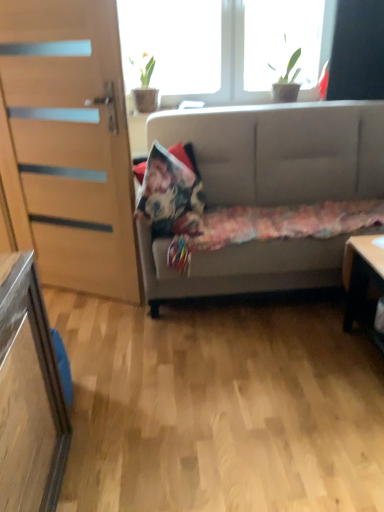
Measure the distance between wooden door at left and camera.

wooden door at left and camera are 5.88 feet apart from each other.

What is the approximate height of light gray fabric couch at center?

light gray fabric couch at center is 3.38 feet tall.

This screenshot has width=384, height=512. What do you see at coordinates (282, 151) in the screenshot?
I see `light gray fabric couch at center` at bounding box center [282, 151].

Locate an element on the screen. The image size is (384, 512). floral fabric pillow at center is located at coordinates (170, 191).

Locate an element on the screen. transparent glass window at upper center, arranged as the 1th window when viewed from the left is located at coordinates tap(189, 49).

In order to face light brown wood desk at lower right, should I rotate leftwards or rightwards?

You should rotate right by 25.357 degrees.

Where is `green leafy plant at upper right, which is counted as the 2th window, starting from the left`? This screenshot has height=512, width=384. green leafy plant at upper right, which is counted as the 2th window, starting from the left is located at coordinates (281, 41).

What's the angular difference between green leafy plant at upper center and wooden door at left's facing directions?

They differ by 25.9 degrees in their facing directions.

Image resolution: width=384 pixels, height=512 pixels. Identify the location of houseplant located above the wooden door at left (from the image's perspective). (146, 87).

From the image's perspective, is green leafy plant at upper center under wooden door at left?

No, from the image's perspective, green leafy plant at upper center is not beneath wooden door at left.

Based on the photo, is the surface of green leafy plant at upper center in direct contact with wooden door at left?

No, green leafy plant at upper center is not beside wooden door at left.

Is floral fabric pillow at center facing away from transparent glass window at upper center, arranged as the 1th window when viewed from the left?

No, transparent glass window at upper center, arranged as the 1th window when viewed from the left, is not at the back of floral fabric pillow at center.

Based on their positions, is floral fabric pillow at center located to the left or right of transparent glass window at upper center, which is the 2th window in right-to-left order?

Based on their positions, floral fabric pillow at center is located to the left of transparent glass window at upper center, which is the 2th window in right-to-left order.

Can you confirm if floral fabric pillow at center is thinner than transparent glass window at upper center, arranged as the 1th window when viewed from the left?

No, floral fabric pillow at center is not thinner than transparent glass window at upper center, arranged as the 1th window when viewed from the left.

Considering the sizes of objects floral fabric pillow at center and transparent glass window at upper center, which is the 2th window in right-to-left order, in the image provided, who is smaller, floral fabric pillow at center or transparent glass window at upper center, which is the 2th window in right-to-left order,?

With smaller size is floral fabric pillow at center.

Based on their sizes in the image, would you say green leafy plant at upper right, which is the 1th window from right to left, is bigger or smaller than floral fabric pillow at center?

green leafy plant at upper right, which is the 1th window from right to left, is smaller than floral fabric pillow at center.

Is floral fabric pillow at center a part of green leafy plant at upper right, which is the 1th window from right to left?

No, green leafy plant at upper right, which is the 1th window from right to left, does not contain floral fabric pillow at center.

Could you tell me if green leafy plant at upper right, which is counted as the 2th window, starting from the left, is facing floral fabric pillow at center?

No.

Identify the location of pillow directly beneath the green leafy plant at upper right, which is counted as the 2th window, starting from the left (from a real-world perspective). This screenshot has height=512, width=384. (170, 191).

From a real-world perspective, which object rests below the other?

In real-world perspective, light brown wood desk at lower right is lower.

Is light brown wood desk at lower right in front of or behind green leafy plant at upper right, which is the 1th window from right to left, in the image?

Visually, light brown wood desk at lower right is located in front of green leafy plant at upper right, which is the 1th window from right to left.

From the image's perspective, which is above, light brown wood desk at lower right or green leafy plant at upper right, which is the 1th window from right to left?

From the image's view, green leafy plant at upper right, which is the 1th window from right to left, is above.

Measure the distance from light brown wood desk at lower right to green leafy plant at upper right, which is counted as the 2th window, starting from the left.

light brown wood desk at lower right and green leafy plant at upper right, which is counted as the 2th window, starting from the left, are 5.44 feet apart from each other.

Considering the sizes of objects green leafy plant at upper right, which is counted as the 2th window, starting from the left, and fluffy multicolored blanket at center in the image provided, who is taller, green leafy plant at upper right, which is counted as the 2th window, starting from the left, or fluffy multicolored blanket at center?

Standing taller between the two is green leafy plant at upper right, which is counted as the 2th window, starting from the left.

Looking at their sizes, would you say green leafy plant at upper right, which is the 1th window from right to left, is wider or thinner than fluffy multicolored blanket at center?

Considering their sizes, green leafy plant at upper right, which is the 1th window from right to left, looks slimmer than fluffy multicolored blanket at center.

Looking at this image, would you say green leafy plant at upper right, which is counted as the 2th window, starting from the left, is part of floral fabric pillow at center's contents?

That's incorrect, green leafy plant at upper right, which is counted as the 2th window, starting from the left, is not inside floral fabric pillow at center.

In the image, is floral fabric pillow at center positioned in front of or behind green leafy plant at upper right, which is counted as the 2th window, starting from the left?

Visually, floral fabric pillow at center is located in front of green leafy plant at upper right, which is counted as the 2th window, starting from the left.

Is floral fabric pillow at center wider or thinner than green leafy plant at upper right, which is counted as the 2th window, starting from the left?

In the image, floral fabric pillow at center appears to be more narrow than green leafy plant at upper right, which is counted as the 2th window, starting from the left.

From the image's perspective, would you say floral fabric pillow at center is positioned over green leafy plant at upper right, which is counted as the 2th window, starting from the left?

No, from the image's perspective, floral fabric pillow at center is not above green leafy plant at upper right, which is counted as the 2th window, starting from the left.

Is the position of light gray fabric couch at center more distant than that of light brown wood desk at lower right?

Yes, the depth of light gray fabric couch at center is greater than that of light brown wood desk at lower right.

Is light gray fabric couch at center not within light brown wood desk at lower right?

Yes, light gray fabric couch at center is not within light brown wood desk at lower right.

Find the location of a particular element. The height and width of the screenshot is (512, 384). desk that is below the light gray fabric couch at center (from the image's perspective) is located at coordinates (361, 274).

Where is `door that is on the left side of green leafy plant at upper center`? door that is on the left side of green leafy plant at upper center is located at coordinates (68, 144).

In order to click on pillow lying below the transparent glass window at upper center, arranged as the 1th window when viewed from the left (from the image's perspective) in this screenshot , I will do `click(170, 191)`.

Based on their spatial positions, is light brown wood desk at lower right or floral fabric pillow at center closer to green leafy plant at upper right, which is the 1th window from right to left?

Among the two, floral fabric pillow at center is located nearer to green leafy plant at upper right, which is the 1th window from right to left.

Estimate the real-world distances between objects in this image. Which object is closer to green leafy plant at upper center, green leafy plant at upper right, which is counted as the 2th window, starting from the left, or floral fabric pillow at center?

Based on the image, floral fabric pillow at center appears to be nearer to green leafy plant at upper center.

Based on the photo, estimate the real-world distances between objects in this image. Which object is further from light gray fabric couch at center, fluffy multicolored blanket at center or wooden door at left?

wooden door at left.

Which object lies further to the anchor point floral fabric pillow at center, green leafy plant at upper center or fluffy multicolored blanket at center?

Based on the image, green leafy plant at upper center appears to be further to floral fabric pillow at center.

Considering their positions, is light brown wood desk at lower right positioned further to wooden door at left than light gray fabric couch at center?

The object further to wooden door at left is light brown wood desk at lower right.

From the image, which object appears to be farther from light gray fabric couch at center, fluffy multicolored blanket at center or floral fabric pillow at center?

Based on the image, floral fabric pillow at center appears to be further to light gray fabric couch at center.

When comparing their distances from green leafy plant at upper center, does light gray fabric couch at center or floral fabric pillow at center seem closer?

light gray fabric couch at center is positioned closer to the anchor green leafy plant at upper center.

Considering their positions, is green leafy plant at upper center positioned closer to transparent glass window at upper center, arranged as the 1th window when viewed from the left, than wooden door at left?

green leafy plant at upper center.

The height and width of the screenshot is (512, 384). In order to click on pillow between green leafy plant at upper right, which is the 1th window from right to left, and fluffy multicolored blanket at center, in the vertical direction in this screenshot , I will do `click(170, 191)`.

You are a GUI agent. You are given a task and a screenshot of the screen. Output one action in this format:
    pyautogui.click(x=<x>, y=<y>)
    Task: Click on the studio couch between floral fabric pillow at center and light brown wood desk at lower right in the horizontal direction
    This screenshot has height=512, width=384.
    Given the screenshot: What is the action you would take?
    pyautogui.click(x=282, y=151)

You are a GUI agent. You are given a task and a screenshot of the screen. Output one action in this format:
    pyautogui.click(x=<x>, y=<y>)
    Task: Click on the houseplant situated between wooden door at left and light brown wood desk at lower right from left to right
    
    Given the screenshot: What is the action you would take?
    pyautogui.click(x=146, y=87)

Where is `bedding between transparent glass window at upper center, arranged as the 1th window when viewed from the left, and light brown wood desk at lower right, in the vertical direction`? This screenshot has height=512, width=384. bedding between transparent glass window at upper center, arranged as the 1th window when viewed from the left, and light brown wood desk at lower right, in the vertical direction is located at coordinates (267, 226).